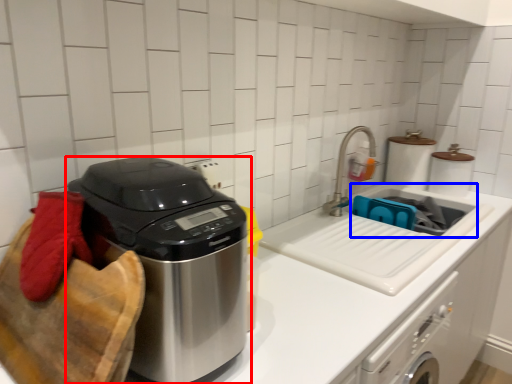
Question: Among these objects, which one is farthest to the camera, home appliance (highlighted by a red box) or sink (highlighted by a blue box)?

Choices:
 (A) home appliance
 (B) sink

Answer: (B)